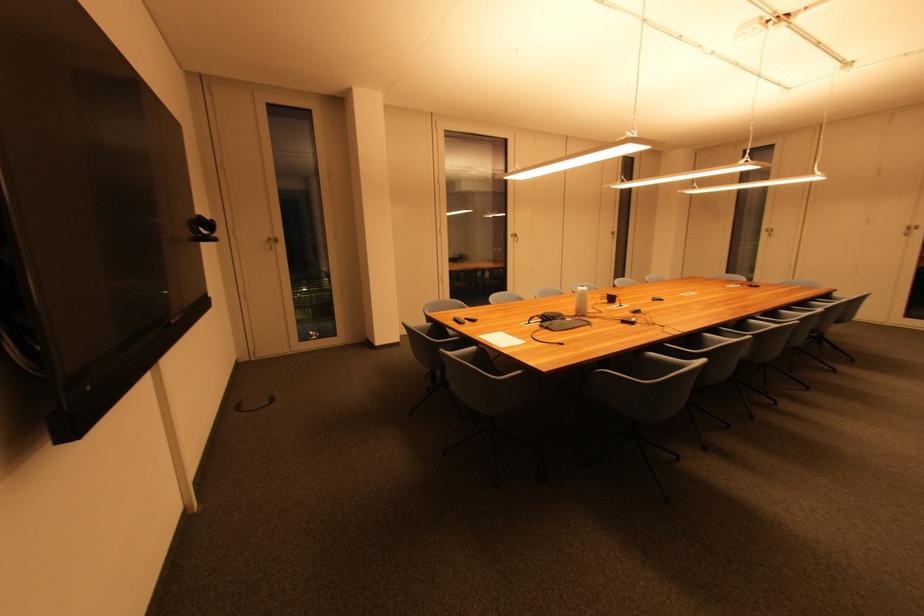
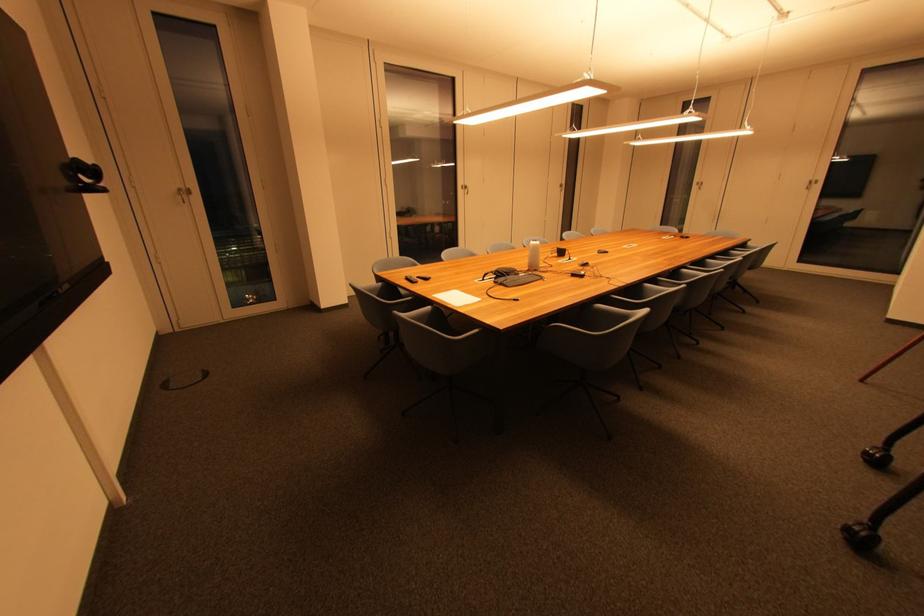
In the second image, find the point that corresponds to point 463,339 in the first image.

(416, 300)